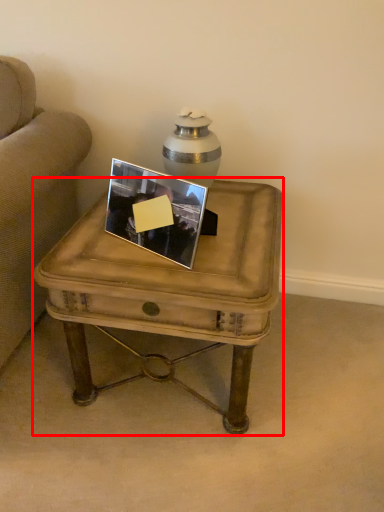
Question: From the image's perspective, where is coffee table (annotated by the red box) located relative to picture frame?

Choices:
 (A) above
 (B) below

Answer: (B)